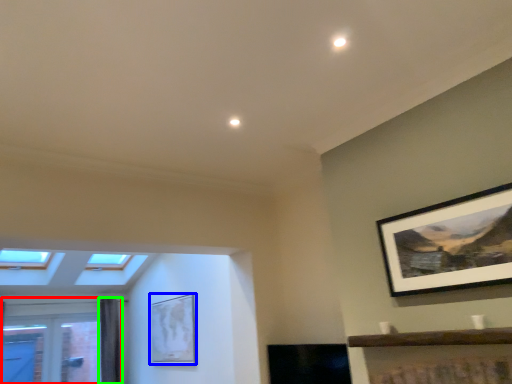
Question: Based on their relative distances, which object is farther from window (highlighted by a red box)? Choose from picture frame (highlighted by a blue box) and curtain (highlighted by a green box).

Choices:
 (A) picture frame
 (B) curtain

Answer: (A)